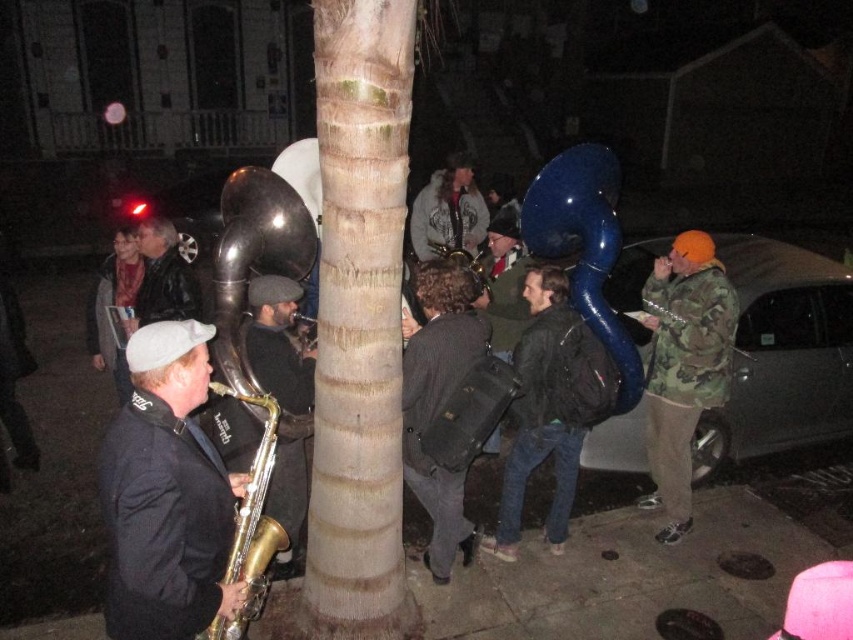
You are a photographer standing in front of the musicians. You want to take a photo that includes both the camo jacket at right and the shiny silver saxophone at center. Which object should you focus on first if you want to ensure both are in the frame?

The camo jacket at right is much taller than the shiny silver saxophone at center, so you should focus on the camo jacket at right first to ensure it fits within the frame.

You are a photographer standing at the center of the scene. You want to take a photo of the camo jacket at right and the tree trunk on the left. How far apart are these two objects in meters?

The camo jacket at right and the tree trunk on the left are 4.21 meters apart.

You are standing in the nighttime scene and want to place a small decoration between the two points, point (282,403) and point (503,248). Which point should the decoration be closer to in order to appear larger in the image?

The decoration should be placed closer to point (282,403) because it is closer to the camera, making objects placed there appear larger in the image.